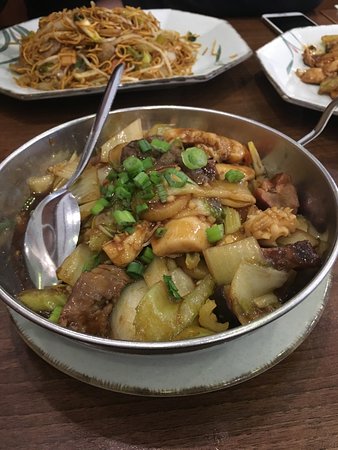
At what (x,y) coordinates should I click in order to perform the action: click on plate. Please return your answer as a coordinate pair (x, y). This screenshot has width=338, height=450. Looking at the image, I should click on (279, 75).